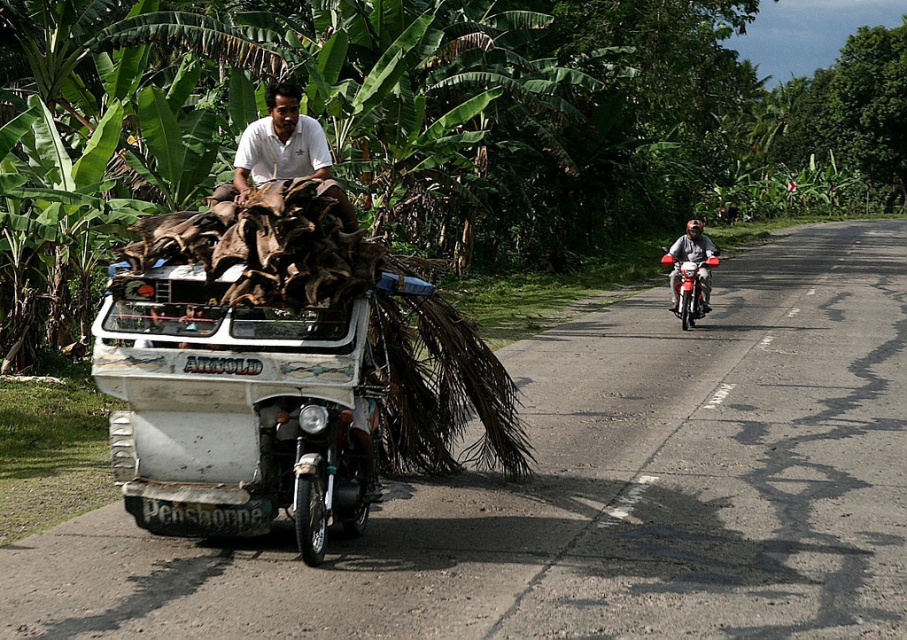
Is white painted wood tricycle at center to the left of red glossy motorcycle at right from the viewer's perspective?

Indeed, white painted wood tricycle at center is positioned on the left side of red glossy motorcycle at right.

Locate an element on the screen. white painted wood tricycle at center is located at coordinates (236, 408).